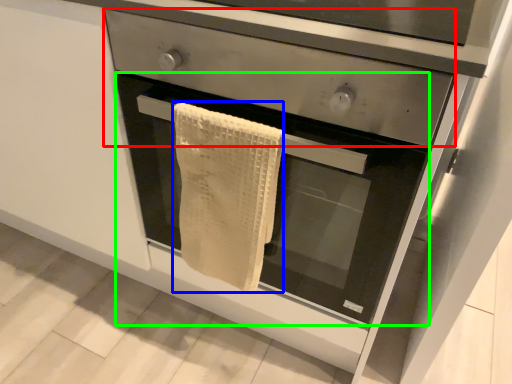
Question: Based on their relative distances, which object is nearer to drawer (highlighted by a red box)? Choose from bath towel (highlighted by a blue box) and oven (highlighted by a green box).

Choices:
 (A) bath towel
 (B) oven

Answer: (A)